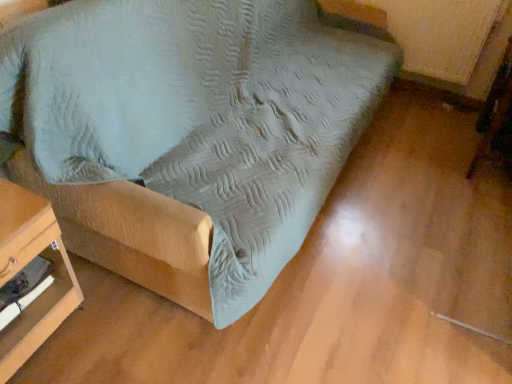
This screenshot has height=384, width=512. In order to click on free space to the left of wooden swivel chair at lower right in this screenshot , I will do `click(421, 150)`.